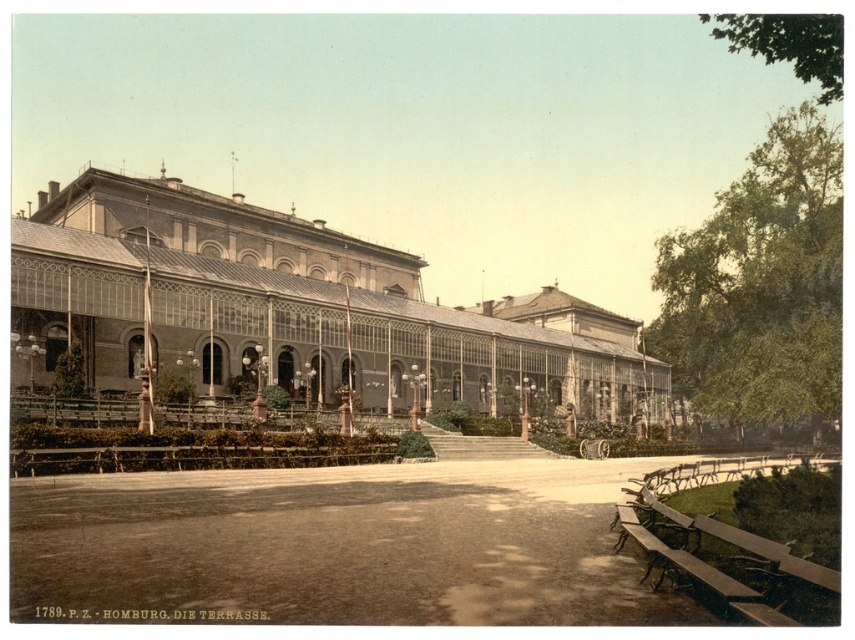
You are standing at the entrance of the building and want to take a photo of the matte glass palace at center. Based on its coordinates, is it positioned to the left or right of the center point of the image?

The matte glass palace at center is located at point (298, 307). Since the coordinates are close to 0.5 on both axes, it is positioned near the center of the image.

You are a visitor at the Homburg. Die Terrasse, and you want to take a photo of the matte glass palace at center from the wooden park bench at lower right. Is the bench positioned in a way that allows you to see the entire palace without any obstructions?

The matte glass palace at center is positioned over wooden park bench at lower right, meaning the bench is directly beneath the palace. This placement might block your view of the palace from that angle, so you might need to move to a different location for an unobstructed shot.

You are standing at the entrance of the grand building labeled Homburg. Die Terrasse. You see a point marked at coordinates [298,307]. Based on the scene description, where exactly is this point located?

The point at coordinates [298,307] is located on the matte glass palace at center.